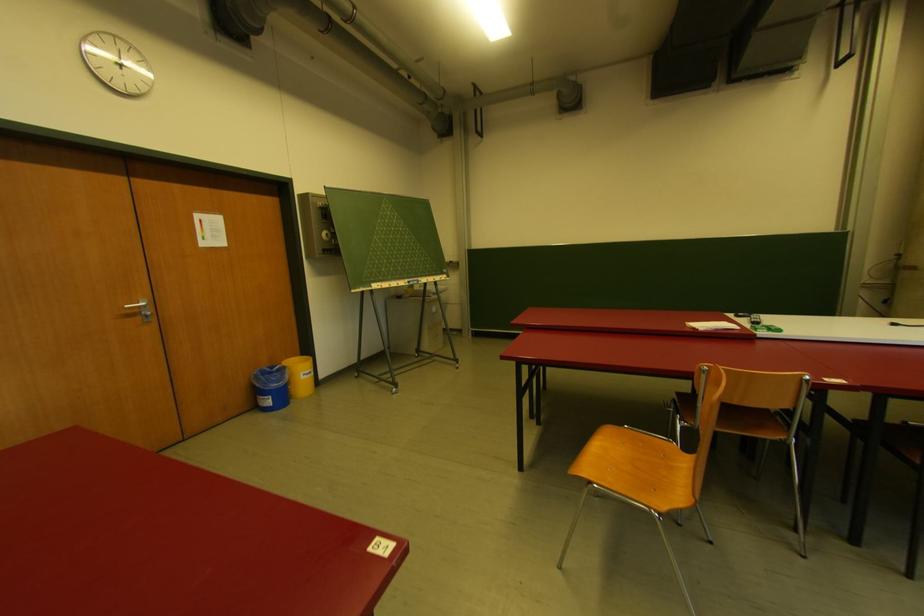
Which object does [299,376] point to?

It corresponds to the yellow bucket in the image.